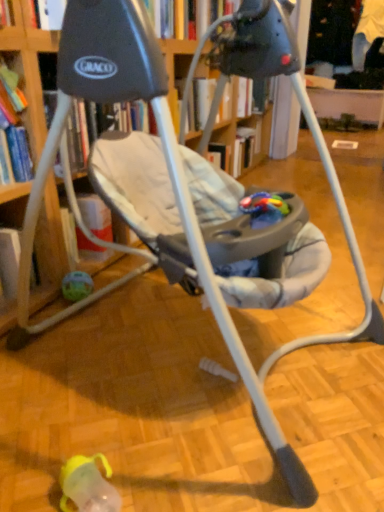
Question: From the image's perspective, relative to translucent plastic ball at lower left, the second toy positioned from the front, is rubberized plastic teething toy at center, which appears as the 1th toy when viewed from the right, above or below?

Choices:
 (A) above
 (B) below

Answer: (A)

Question: Considering their positions, is rubberized plastic teething toy at center, acting as the 2th toy starting from the back, located in front of or behind translucent plastic ball at lower left, the 1th toy from the left?

Choices:
 (A) front
 (B) behind

Answer: (A)

Question: From a real-world perspective, is rubberized plastic teething toy at center, which appears as the 1th toy when viewed from the right, above or below translucent plastic ball at lower left, placed as the 2th toy when sorted from right to left?

Choices:
 (A) above
 (B) below

Answer: (A)

Question: Looking at the image, does translucent plastic ball at lower left, the second toy positioned from the front, seem bigger or smaller compared to rubberized plastic teething toy at center, acting as the 2th toy starting from the back?

Choices:
 (A) small
 (B) big

Answer: (B)

Question: Is translucent plastic ball at lower left, placed as the 2th toy when sorted from right to left, spatially inside rubberized plastic teething toy at center, which ranks as the second toy in bottom-to-top order, or outside of it?

Choices:
 (A) inside
 (B) outside

Answer: (B)

Question: From a real-world perspective, relative to rubberized plastic teething toy at center, positioned as the 1th toy in front-to-back order, is translucent plastic ball at lower left, the 1th toy from the left, vertically above or below?

Choices:
 (A) above
 (B) below

Answer: (B)

Question: From the image's perspective, is translucent plastic ball at lower left, the second toy positioned from the front, positioned above or below rubberized plastic teething toy at center, which appears as the 1th toy when viewed from the right?

Choices:
 (A) above
 (B) below

Answer: (B)